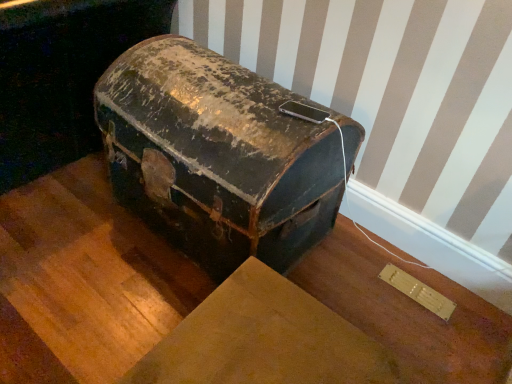
Question: From the image's perspective, is rusty leather suitcase at center under rusty metal trunk at center?

Choices:
 (A) yes
 (B) no

Answer: (A)

Question: Does rusty leather suitcase at center have a greater width compared to rusty metal trunk at center?

Choices:
 (A) yes
 (B) no

Answer: (B)

Question: Is rusty leather suitcase at center positioned in front of rusty metal trunk at center?

Choices:
 (A) yes
 (B) no

Answer: (A)

Question: Is rusty leather suitcase at center positioned behind rusty metal trunk at center?

Choices:
 (A) no
 (B) yes

Answer: (A)

Question: Is rusty leather suitcase at center taller than rusty metal trunk at center?

Choices:
 (A) no
 (B) yes

Answer: (A)

Question: From the image's perspective, is rusty leather suitcase at center over rusty metal trunk at center?

Choices:
 (A) yes
 (B) no

Answer: (B)

Question: Is rusty metal trunk at center wider than rusty leather suitcase at center?

Choices:
 (A) yes
 (B) no

Answer: (A)

Question: Can you confirm if rusty metal trunk at center is thinner than rusty leather suitcase at center?

Choices:
 (A) yes
 (B) no

Answer: (B)

Question: Considering the relative positions of rusty metal trunk at center and rusty leather suitcase at center in the image provided, is rusty metal trunk at center to the right of rusty leather suitcase at center from the viewer's perspective?

Choices:
 (A) yes
 (B) no

Answer: (B)

Question: Is rusty metal trunk at center oriented away from rusty leather suitcase at center?

Choices:
 (A) yes
 (B) no

Answer: (B)

Question: Can you confirm if rusty metal trunk at center is taller than rusty leather suitcase at center?

Choices:
 (A) no
 (B) yes

Answer: (B)

Question: Is rusty metal trunk at center not within rusty leather suitcase at center?

Choices:
 (A) yes
 (B) no

Answer: (A)

Question: In terms of height, does rusty metal trunk at center look taller or shorter compared to rusty leather suitcase at center?

Choices:
 (A) tall
 (B) short

Answer: (A)